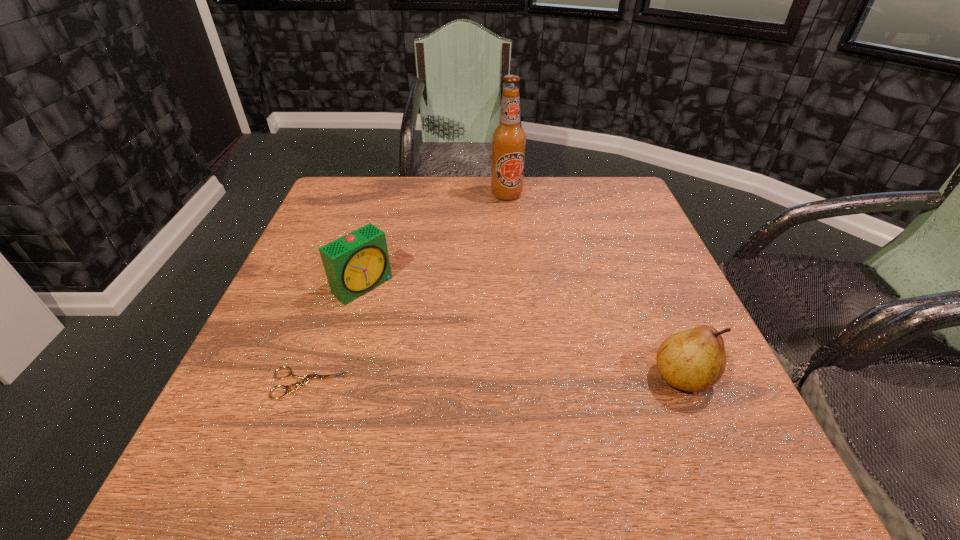
You are a GUI agent. You are given a task and a screenshot of the screen. Output one action in this format:
    pyautogui.click(x=<x>, y=<y>)
    Task: Click on the shears
    
    Given the screenshot: What is the action you would take?
    pyautogui.click(x=305, y=379)

You are a GUI agent. You are given a task and a screenshot of the screen. Output one action in this format:
    pyautogui.click(x=<x>, y=<y>)
    Task: Click on the pear
    This screenshot has height=540, width=960.
    Given the screenshot: What is the action you would take?
    pyautogui.click(x=693, y=360)

Find the location of a particular element. the tallest object is located at coordinates (508, 139).

Locate an element on the screen. Image resolution: width=960 pixels, height=540 pixels. the second object from right to left is located at coordinates (508, 139).

At what (x,y) coordinates should I click in order to perform the action: click on alarm clock. Please return your answer as a coordinate pair (x, y). This screenshot has height=540, width=960. Looking at the image, I should click on (356, 263).

The height and width of the screenshot is (540, 960). What are the coordinates of `vacant region located on the back of the shortest object` in the screenshot? It's located at (350, 262).

The image size is (960, 540). In order to click on vacant space located 0.120m on the left of the pear in this screenshot , I will do `click(587, 377)`.

At what (x,y) coordinates should I click in order to perform the action: click on vacant space positioned 0.220m on the front label of the tallest object. Please return your answer as a coordinate pair (x, y). Image resolution: width=960 pixels, height=540 pixels. Looking at the image, I should click on (516, 251).

The image size is (960, 540). I want to click on vacant space located on the front label of the tallest object, so click(514, 232).

I want to click on vacant position located 0.300m on the front label of the tallest object, so click(x=520, y=272).